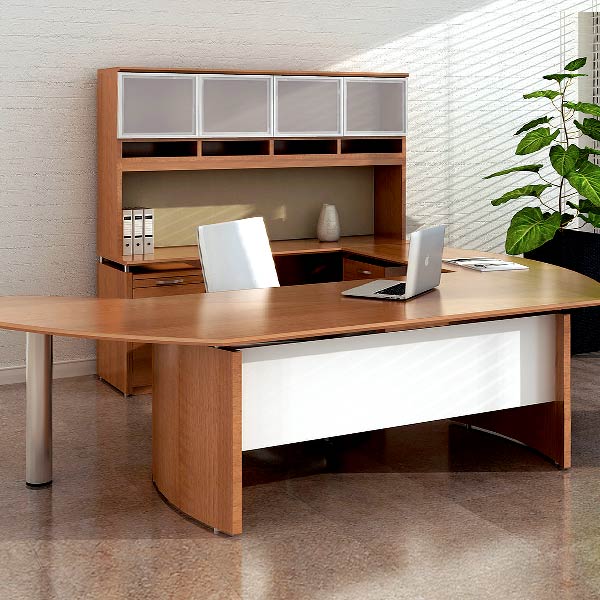
Identify the location of top cabinet. (157, 119), (224, 117), (319, 106), (386, 117).